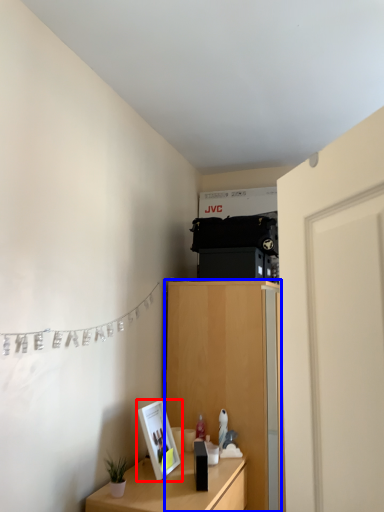
Question: Which object appears farthest to the camera in this image, picture frame (highlighted by a red box) or cabinetry (highlighted by a blue box)?

Choices:
 (A) picture frame
 (B) cabinetry

Answer: (B)